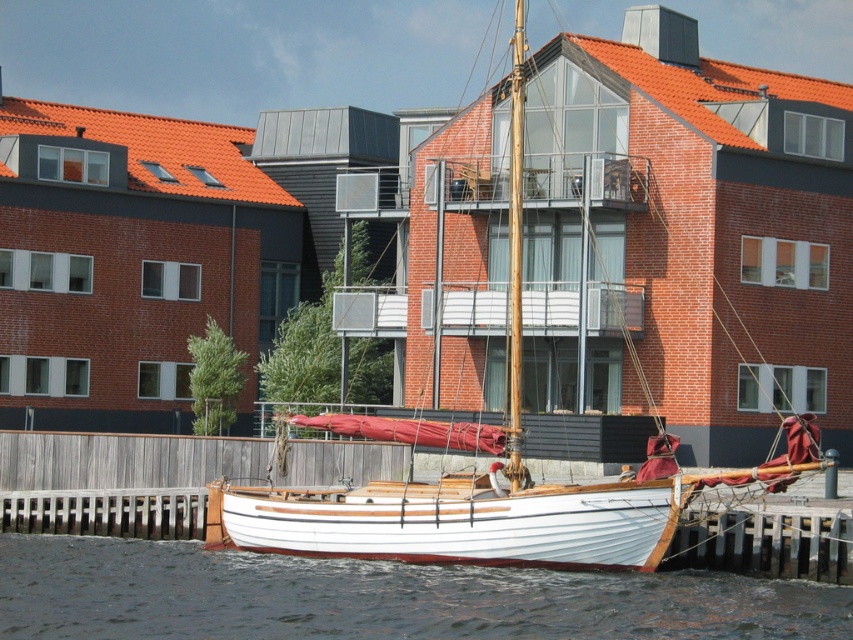
Question: Is white wood sailboat at center wider than white smooth water at lower center?

Choices:
 (A) yes
 (B) no

Answer: (A)

Question: Which of the following is the farthest from the observer?

Choices:
 (A) white smooth water at lower center
 (B) white wood sailboat at center

Answer: (B)

Question: Does white wood sailboat at center have a smaller size compared to white smooth water at lower center?

Choices:
 (A) yes
 (B) no

Answer: (B)

Question: Can you confirm if white wood sailboat at center is wider than white smooth water at lower center?

Choices:
 (A) no
 (B) yes

Answer: (B)